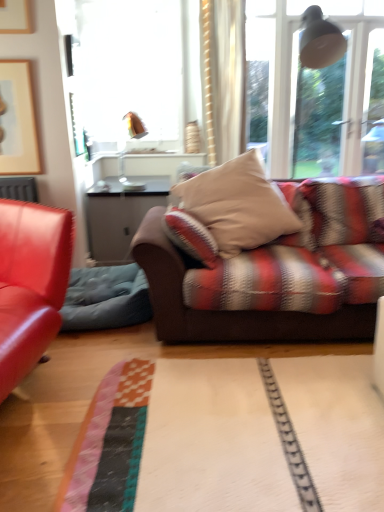
Question: Is matte wooden picture frame at upper left taller or shorter than velvet blue swivel chair at left?

Choices:
 (A) tall
 (B) short

Answer: (A)

Question: In terms of size, does matte wooden picture frame at upper left appear bigger or smaller than velvet blue swivel chair at left?

Choices:
 (A) big
 (B) small

Answer: (B)

Question: Which is nearer to the velvet blue swivel chair at left?

Choices:
 (A) transparent glass window at upper center
 (B) copper metallic lamp at upper center
 (C) matte wooden picture frame at upper left
 (D) beige fabric pillow at center

Answer: (D)

Question: Which is nearer to the matte wooden picture frame at upper left?

Choices:
 (A) transparent glass window at upper center
 (B) velvet blue swivel chair at left
 (C) beige fabric pillow at center
 (D) copper metallic lamp at upper center

Answer: (B)